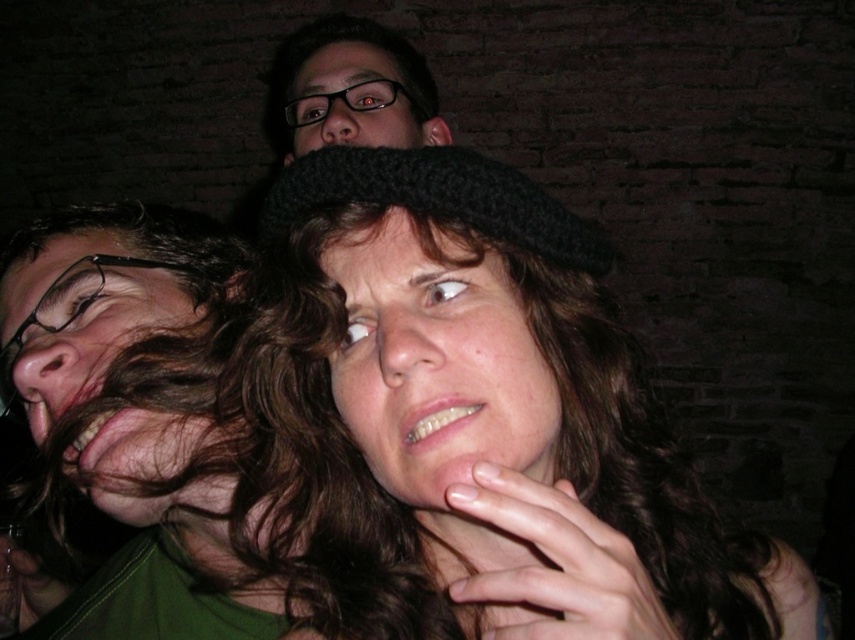
Does knitted woolen hat at center have a lesser width compared to brown hair at left?

Indeed, knitted woolen hat at center has a lesser width compared to brown hair at left.

Locate an element on the screen. Image resolution: width=855 pixels, height=640 pixels. knitted woolen hat at center is located at coordinates (438, 365).

In the scene shown: Can you confirm if black knitted hat at center is positioned above knitted woolen hat at center?

No, black knitted hat at center is not above knitted woolen hat at center.

Does black knitted hat at center have a greater height compared to knitted woolen hat at center?

Indeed, black knitted hat at center has a greater height compared to knitted woolen hat at center.

Identify the location of black knitted hat at center. This screenshot has width=855, height=640. (517, 408).

Locate an element on the screen. This screenshot has height=640, width=855. black knitted hat at center is located at coordinates (517, 408).

Is black knitted hat at center to the left of brown hair at left from the viewer's perspective?

In fact, black knitted hat at center is to the right of brown hair at left.

In the scene shown: Which is more to the right, black knitted hat at center or brown hair at left?

black knitted hat at center

Does point (447, 534) come closer to viewer compared to point (97, 294)?

Yes, point (447, 534) is in front of point (97, 294).

This screenshot has width=855, height=640. I want to click on black knitted hat at center, so click(517, 408).